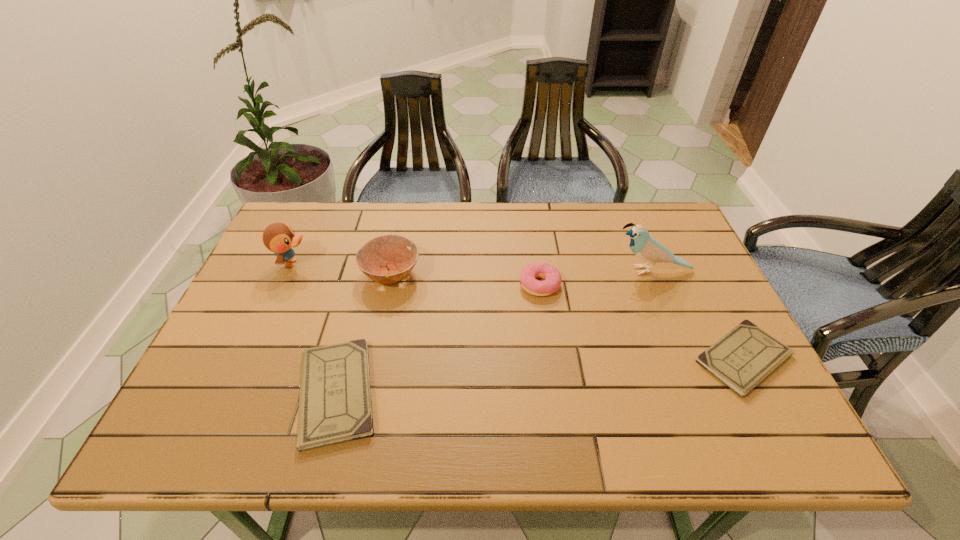
Image resolution: width=960 pixels, height=540 pixels. I want to click on free spot between the leftmost object and the doughnut, so click(x=416, y=274).

Image resolution: width=960 pixels, height=540 pixels. I want to click on vacant space that is in between the left checkbook and the shortest object, so click(x=540, y=376).

The height and width of the screenshot is (540, 960). Identify the location of empty space between the doughnut and the fourth shortest object. (465, 280).

Find the location of a particular element. This screenshot has height=540, width=960. unoccupied position between the shortest object and the left checkbook is located at coordinates (540, 376).

You are a GUI agent. You are given a task and a screenshot of the screen. Output one action in this format:
    pyautogui.click(x=<x>, y=<y>)
    Task: Click on the free space between the leftmost object and the shortest object
    The height and width of the screenshot is (540, 960).
    Given the screenshot: What is the action you would take?
    pyautogui.click(x=518, y=310)

Find the location of a particular element. The image size is (960, 540). free spot between the shortest object and the fourth tallest object is located at coordinates (641, 321).

I want to click on free area in between the bird and the shorter checkbook, so click(x=698, y=314).

Select which object is the fourth closest to the third tallest object. Please provide its 2D coordinates. Your answer should be formatted as a tuple, i.e. [(x, y)], where the tuple contains the x and y coordinates of a point satisfying the conditions above.

[(647, 248)]

Find the location of a particular element. The height and width of the screenshot is (540, 960). the third closest object to the fifth tallest object is located at coordinates (552, 278).

The height and width of the screenshot is (540, 960). What are the coordinates of `free location that satisfies the following two spatial constraints: 1. at the face of the bird; 2. on the left side of the shortest object` in the screenshot? It's located at (687, 359).